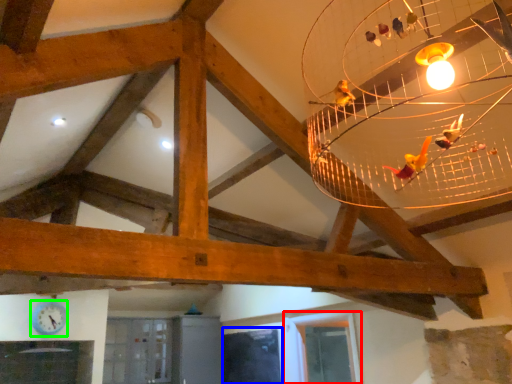
Question: Which is nearer to the window (highlighted by a red box)? window (highlighted by a blue box) or clock (highlighted by a green box).

Choices:
 (A) window
 (B) clock

Answer: (A)